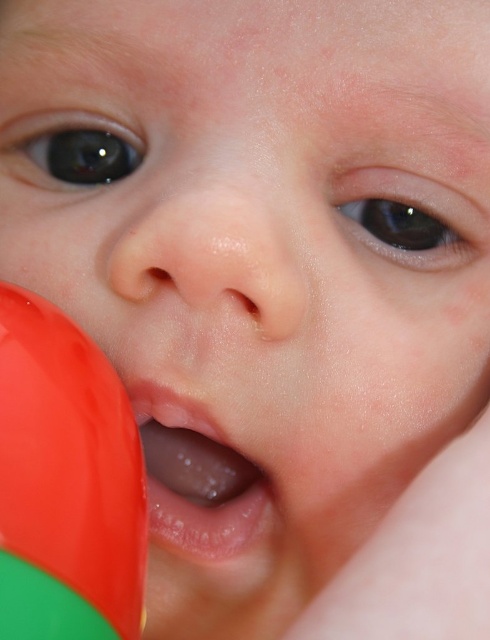
Question: Is smooth skin nose at center wider than transparent plastic mouth at center?

Choices:
 (A) yes
 (B) no

Answer: (A)

Question: Which object is closer to the camera taking this photo?

Choices:
 (A) smooth skin nose at center
 (B) rubberized red ball at lower left

Answer: (B)

Question: Is smooth skin nose at center wider than transparent plastic mouth at center?

Choices:
 (A) no
 (B) yes

Answer: (B)

Question: Which point is closer to the camera?

Choices:
 (A) transparent plastic mouth at center
 (B) rubberized red ball at lower left

Answer: (B)

Question: Does smooth skin nose at center have a lesser width compared to transparent plastic mouth at center?

Choices:
 (A) no
 (B) yes

Answer: (A)

Question: Which point is closer to the camera?

Choices:
 (A) (129, 472)
 (B) (150, 429)

Answer: (A)